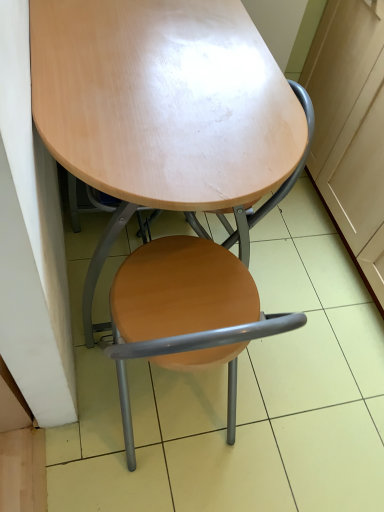
Question: Should I look upward or downward to see wooden seat at center?

Choices:
 (A) down
 (B) up

Answer: (A)

Question: From a real-world perspective, is wooden seat at center located beneath glossy wood table at center?

Choices:
 (A) yes
 (B) no

Answer: (A)

Question: Are wooden seat at center and glossy wood table at center beside each other?

Choices:
 (A) no
 (B) yes

Answer: (A)

Question: From the image's perspective, is wooden seat at center on glossy wood table at center?

Choices:
 (A) no
 (B) yes

Answer: (A)

Question: Is glossy wood table at center surrounded by wooden seat at center?

Choices:
 (A) yes
 (B) no

Answer: (B)

Question: Is wooden seat at center oriented towards glossy wood table at center?

Choices:
 (A) no
 (B) yes

Answer: (B)

Question: Is wooden seat at center thinner than glossy wood table at center?

Choices:
 (A) yes
 (B) no

Answer: (A)

Question: Is wooden seat at center wider than matte wood cabinet at right?

Choices:
 (A) yes
 (B) no

Answer: (B)

Question: Is wooden seat at center further to camera compared to matte wood cabinet at right?

Choices:
 (A) no
 (B) yes

Answer: (A)

Question: Does wooden seat at center come in front of matte wood cabinet at right?

Choices:
 (A) yes
 (B) no

Answer: (A)

Question: Are wooden seat at center and matte wood cabinet at right beside each other?

Choices:
 (A) yes
 (B) no

Answer: (B)

Question: Is wooden seat at center facing away from matte wood cabinet at right?

Choices:
 (A) no
 (B) yes

Answer: (A)

Question: Is matte wood cabinet at right located within wooden seat at center?

Choices:
 (A) no
 (B) yes

Answer: (A)

Question: Is matte wood cabinet at right bigger than wooden seat at center?

Choices:
 (A) yes
 (B) no

Answer: (A)